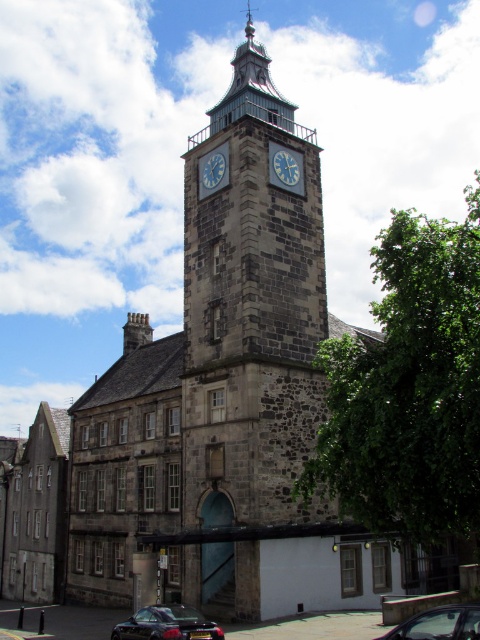
You are a photographer standing in front of the historic stone building. You want to capture both the shiny black car at lower left and the blue metallic clock at center in your shot. Which object will appear larger in the photo?

The shiny black car at lower left will appear larger in the photo because it is taller than the blue metallic clock at center.

You are a delivery person needing to park your metallic silver car at lower center as close as possible to the blue painted metal clock at center. Given that the parking space is exactly 100 feet away from the clock, can you park your car in this space?

The metallic silver car at lower center is 113.21 feet away from the blue painted metal clock at center, which is farther than the 100 feet parking space. Therefore, you cannot park the car in that space.

In the scene shown: You are standing in front of the historic stone building and notice a metallic silver car at lower center and a blue painted metal clock at center. Which object is nearer to you?

The metallic silver car at lower center is closer to the viewer than the blue painted metal clock at center.